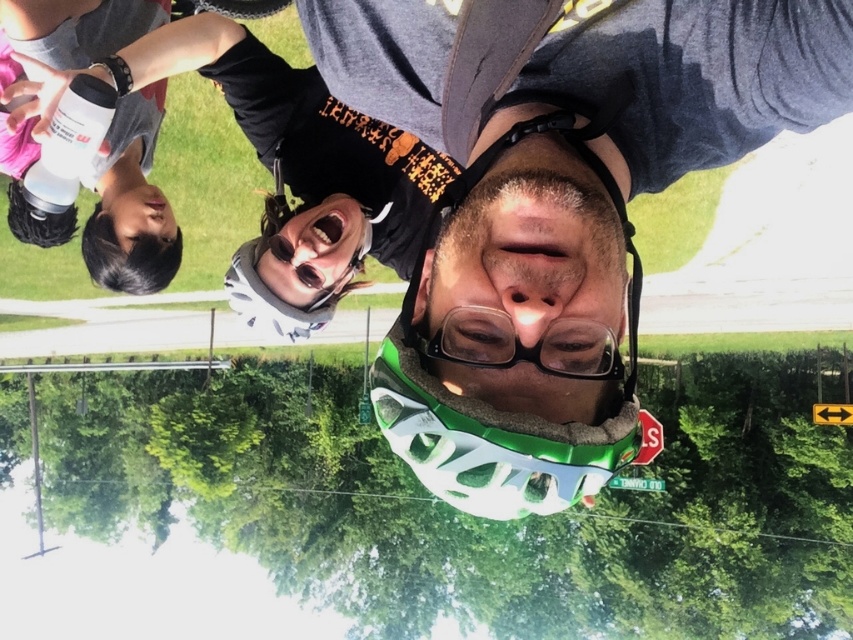
Question: Which of the following is the closest to the observer?

Choices:
 (A) transparent plastic goggles at center
 (B) white matte bottle at upper left
 (C) white matte water bottle at upper left

Answer: (A)

Question: Which point is farther to the camera?

Choices:
 (A) (82, 168)
 (B) (554, 337)

Answer: (A)

Question: Considering the relative positions of white matte water bottle at upper left and white matte bottle at upper left in the image provided, where is white matte water bottle at upper left located with respect to white matte bottle at upper left?

Choices:
 (A) left
 (B) right

Answer: (A)

Question: Does white matte water bottle at upper left have a smaller size compared to transparent plastic goggles at center?

Choices:
 (A) no
 (B) yes

Answer: (A)

Question: Which is farther from the transparent plastic goggles at center?

Choices:
 (A) white matte water bottle at upper left
 (B) white matte bottle at upper left

Answer: (A)

Question: Is transparent plastic goggles at center wider than white matte bottle at upper left?

Choices:
 (A) yes
 (B) no

Answer: (B)